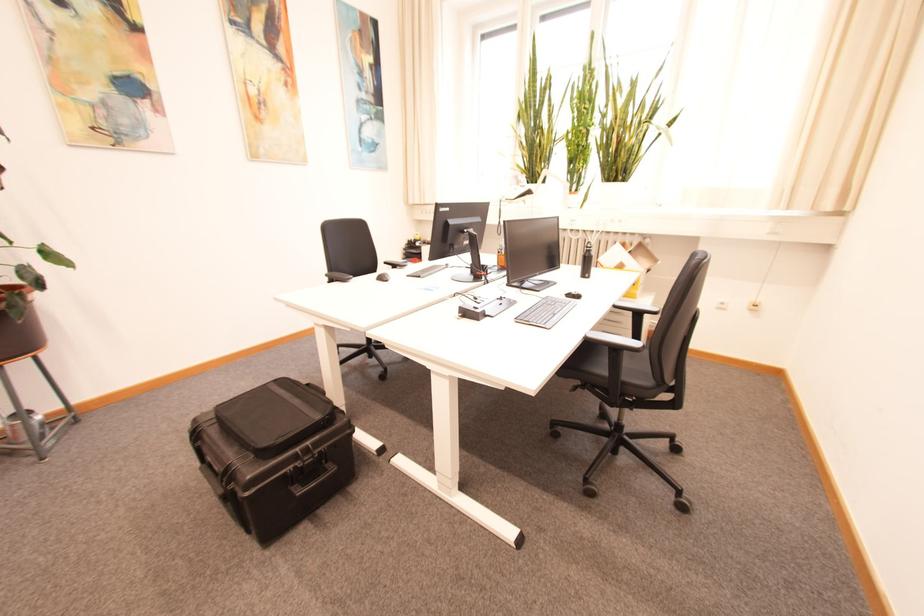
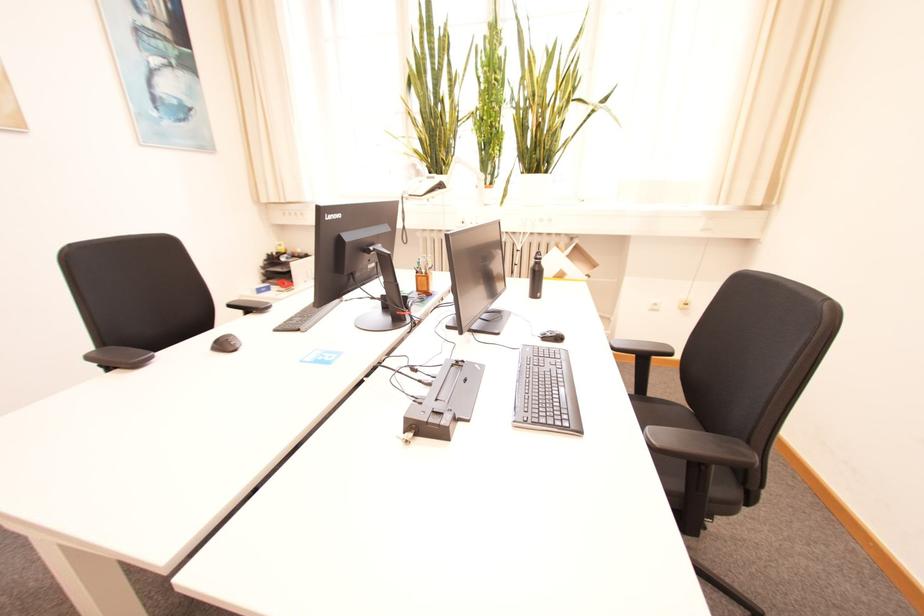
Find the pixel in the second image that matches (388,280) in the first image.

(229, 346)